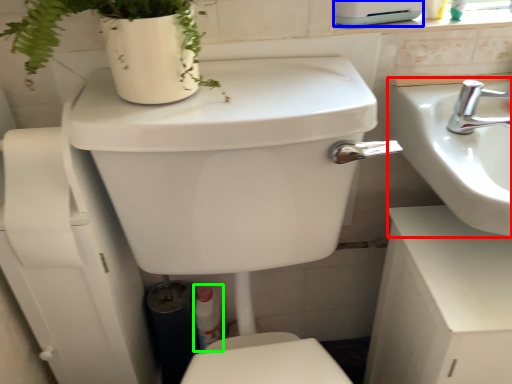
Question: Which is nearer to the sink (highlighted by a red box)? appliance (highlighted by a blue box) or toiletry (highlighted by a green box).

Choices:
 (A) appliance
 (B) toiletry

Answer: (A)